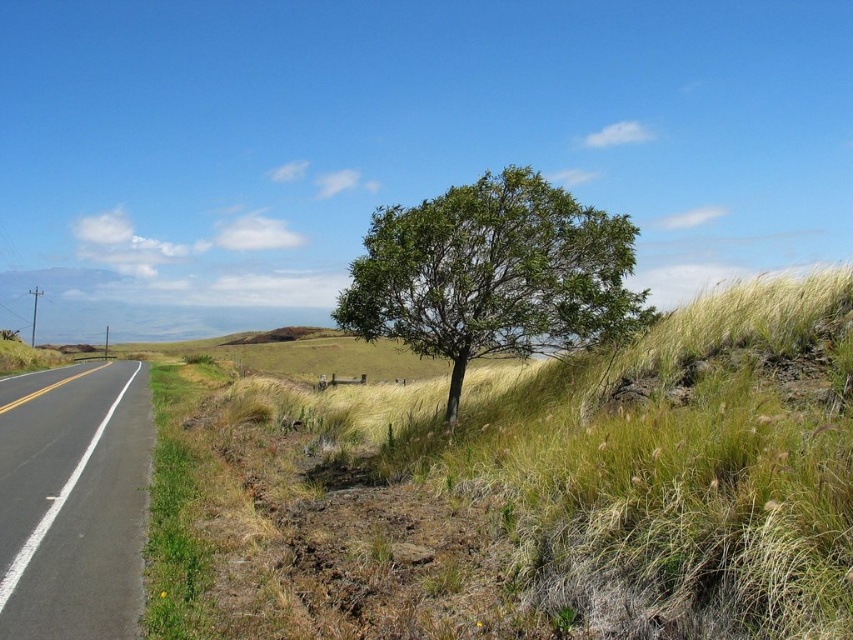
You are a drone operator flying a drone that has a maximum flight distance of 10 meters. You want to capture a closeup of the green leafy tree at center. Can your drone reach the tree?

The green leafy tree at center is 8.78 meters from camera, so yes, the drone can reach the tree as it is within the 10 meter range.

From the picture: You are a bird flying over the rural landscape. You want to land on the highest point between the green leafy tree at center and the black asphalt road at left. Which one should you choose?

The green leafy tree at center is much taller than the black asphalt road at left, so you should choose the green leafy tree at center to land on as it offers the highest point.